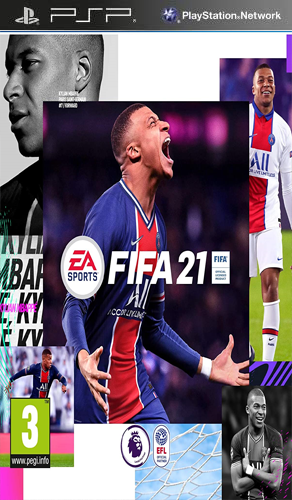
At what (x,y) coordinates should I click in order to perform the action: click on sock. Please return your answer as a coordinate pair (x, y). The image size is (292, 500). Looking at the image, I should click on (272, 313).